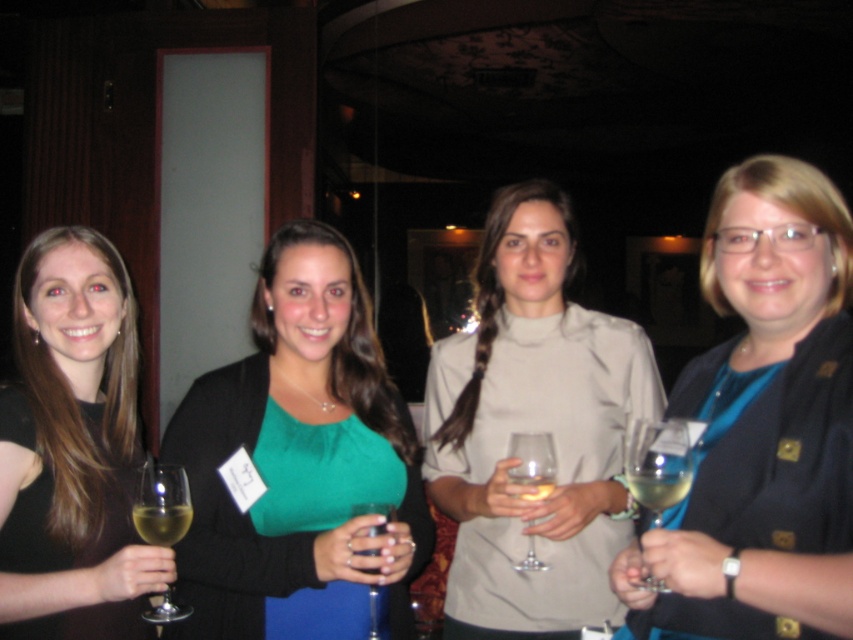
Can you confirm if clear glass wine glass at right is thinner than translucent glass at lower left?

No.

In the scene shown: Does clear glass wine glass at right have a greater height compared to translucent glass at lower left?

Yes.

Locate an element on the screen. The width and height of the screenshot is (853, 640). clear glass wine glass at right is located at coordinates (659, 465).

The image size is (853, 640). Find the location of `clear glass wine glass at right`. clear glass wine glass at right is located at coordinates (659, 465).

Who is higher up, matte black dress at left or clear glass wine at center?

matte black dress at left

Between matte black dress at left and clear glass wine at center, which one has less height?

clear glass wine at center is shorter.

You are a GUI agent. You are given a task and a screenshot of the screen. Output one action in this format:
    pyautogui.click(x=<x>, y=<y>)
    Task: Click on the matte black dress at left
    The height and width of the screenshot is (640, 853).
    Given the screenshot: What is the action you would take?
    pyautogui.click(x=71, y=445)

Where is `matte black dress at left`? The image size is (853, 640). matte black dress at left is located at coordinates (71, 445).

How much distance is there between matte black dress at left and transparent glass wine glass at center?

matte black dress at left and transparent glass wine glass at center are 67.54 centimeters apart from each other.

Between matte black dress at left and transparent glass wine glass at center, which one has more height?

With more height is matte black dress at left.

Between point (12, 497) and point (519, 564), which one is positioned behind?

The point (519, 564) is behind.

At what (x,y) coordinates should I click in order to perform the action: click on matte black dress at left. Please return your answer as a coordinate pair (x, y). The width and height of the screenshot is (853, 640). Looking at the image, I should click on (71, 445).